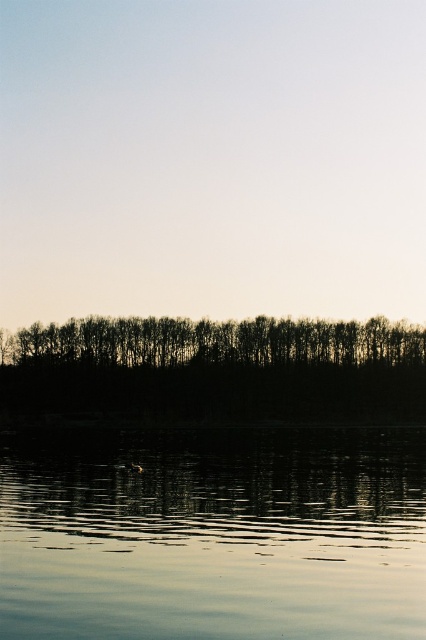
Between point (112, 596) and point (57, 356), which one is positioned behind?

Positioned behind is point (57, 356).

Is smooth reflective water at bottom positioned behind black silhouetted trees at center?

No.

What do you see at coordinates (213, 532) in the screenshot?
I see `smooth reflective water at bottom` at bounding box center [213, 532].

This screenshot has width=426, height=640. I want to click on smooth reflective water at bottom, so click(213, 532).